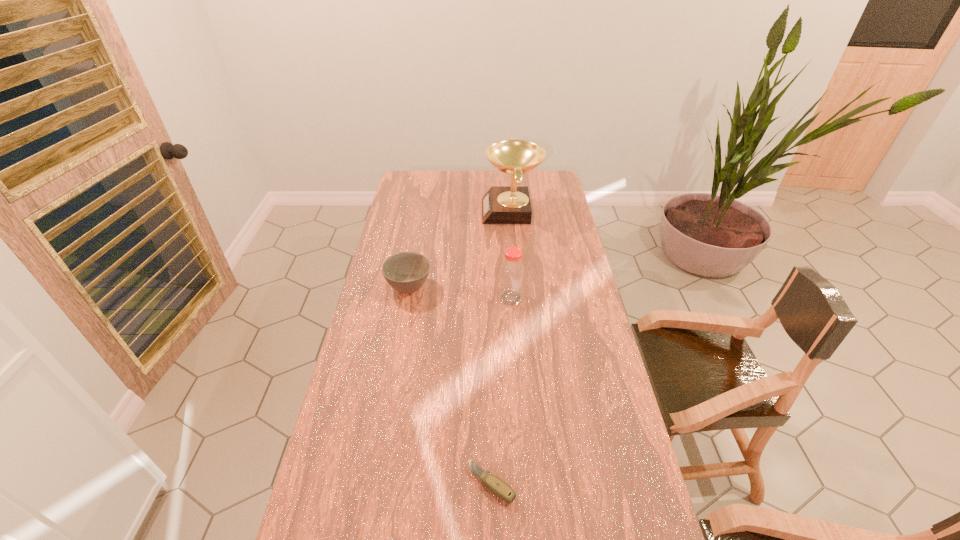
Find the location of a particular element. Image resolution: width=960 pixels, height=540 pixels. blank space at the far left corner of the desktop is located at coordinates (399, 185).

Identify the location of free area in between the bottle and the nearest object. Image resolution: width=960 pixels, height=540 pixels. (501, 390).

Locate an element on the screen. Image resolution: width=960 pixels, height=540 pixels. empty space between the pocketknife and the leftmost object is located at coordinates (450, 385).

This screenshot has height=540, width=960. In order to click on unoccupied position between the nearest object and the bottle in this screenshot , I will do `click(501, 390)`.

The height and width of the screenshot is (540, 960). Identify the location of unoccupied position between the bowl and the second tallest object. (460, 292).

Identify the location of vacant space in between the pocketknife and the bowl. Image resolution: width=960 pixels, height=540 pixels. (450, 385).

Find the location of a particular element. vacant space in between the nearest object and the award is located at coordinates (501, 347).

Where is `free point between the third shortest object and the leftmost object`? The width and height of the screenshot is (960, 540). free point between the third shortest object and the leftmost object is located at coordinates (460, 292).

Locate which object ranks second in proximity to the third tallest object. Please provide its 2D coordinates. Your answer should be formatted as a tuple, i.e. [(x, y)], where the tuple contains the x and y coordinates of a point satisfying the conditions above.

[(511, 204)]

Identify the location of object that ranks as the closest to the second tallest object. Image resolution: width=960 pixels, height=540 pixels. (406, 272).